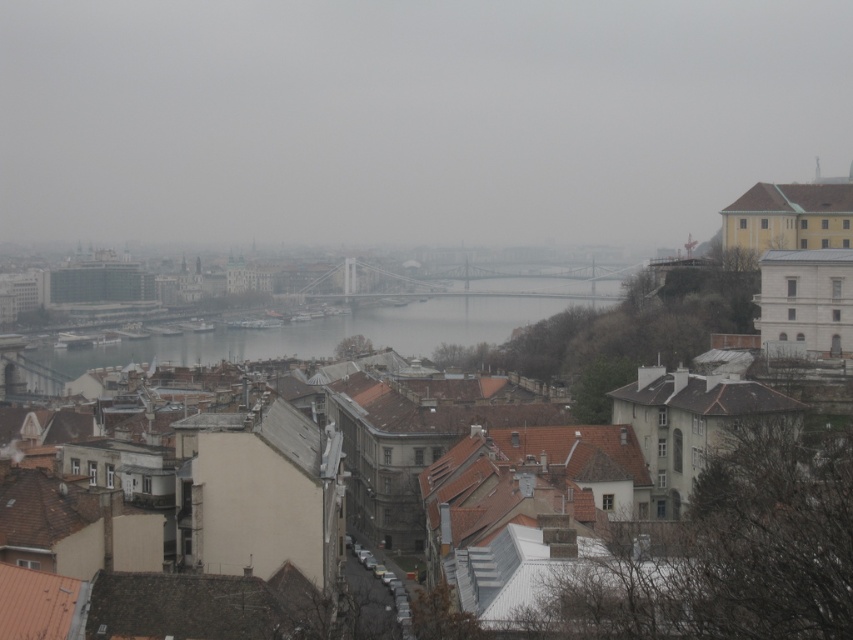
You are standing at the observation deck of the city hall building. You see two points in the cityscape image displayed on the wall. The first point is labeled as point (x=596, y=588) and the second is point (x=178, y=356). Which point is closer to your current position?

Point (x=596, y=588) is closer to the camera than point (x=178, y=356), so the first point is closer to your current position.

You are standing at the point marked by the coordinates point (735, 529) in the cityscape image. Looking around, you see brown tiled roofs at center. What is the most prominent feature directly below your current position?

The point (735, 529) marks brown tiled roofs at center, so the most prominent feature directly below your current position would be the brown tiled roofs at center.

You are a city planner assessing the city layout. You notice the brown tiled roofs at center and the gray concrete water at center. Which of these two features occupies a larger area in the scene?

The gray concrete water at center occupies a larger area than the brown tiled roofs at center since the brown tiled roofs at center has a smaller size compared to gray concrete water at center.